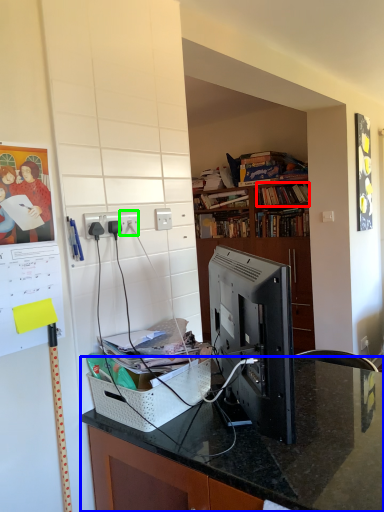
Question: Which object is positioned closest to book (highlighted by a red box)? Select from desk (highlighted by a blue box) and electric outlet (highlighted by a green box).

Choices:
 (A) desk
 (B) electric outlet

Answer: (B)